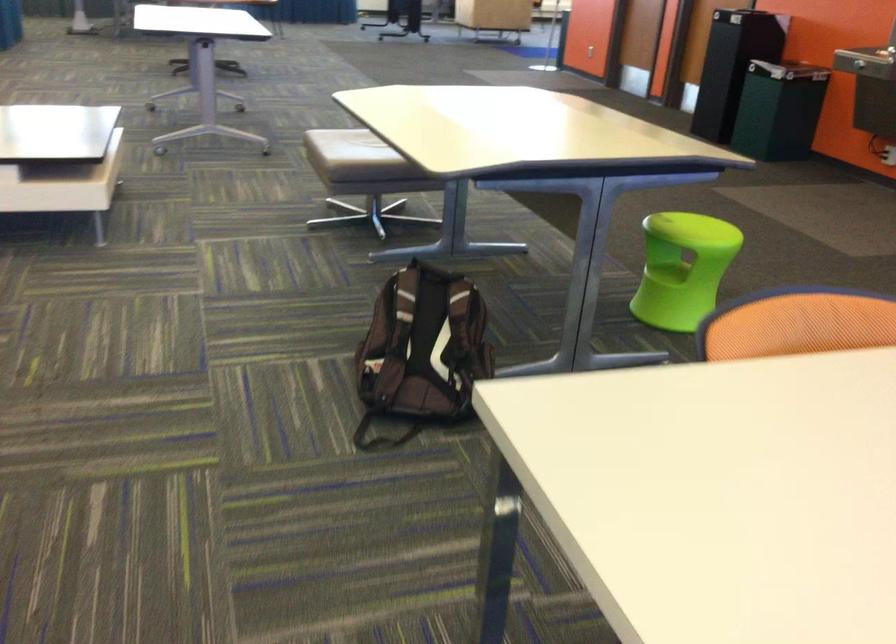
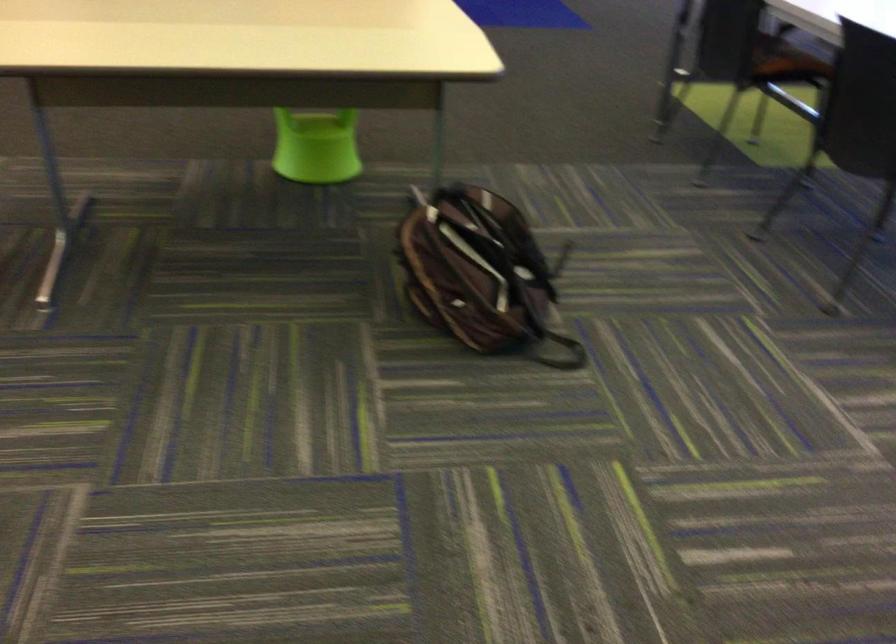
In the second image, find the point that corresponds to point 446,442 in the first image.

(552, 322)